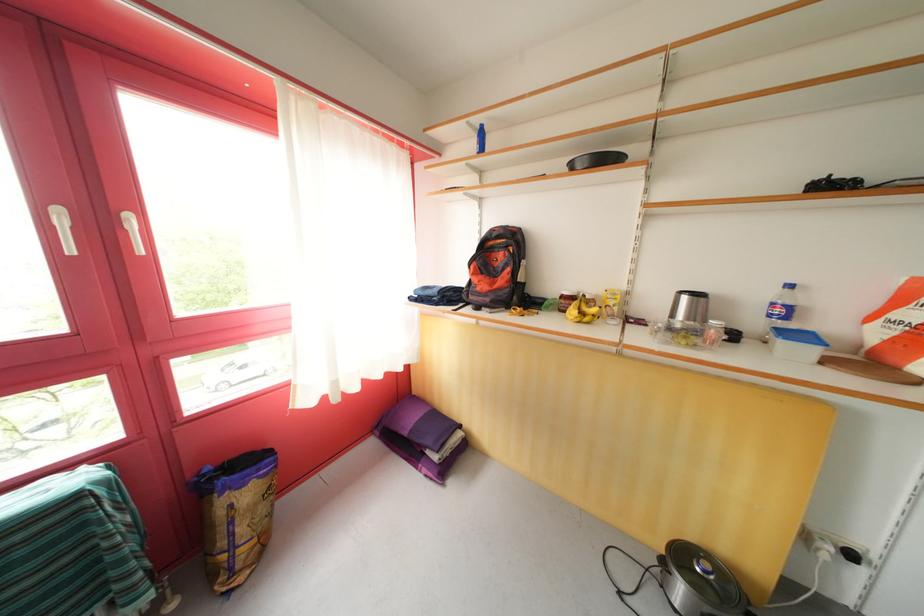
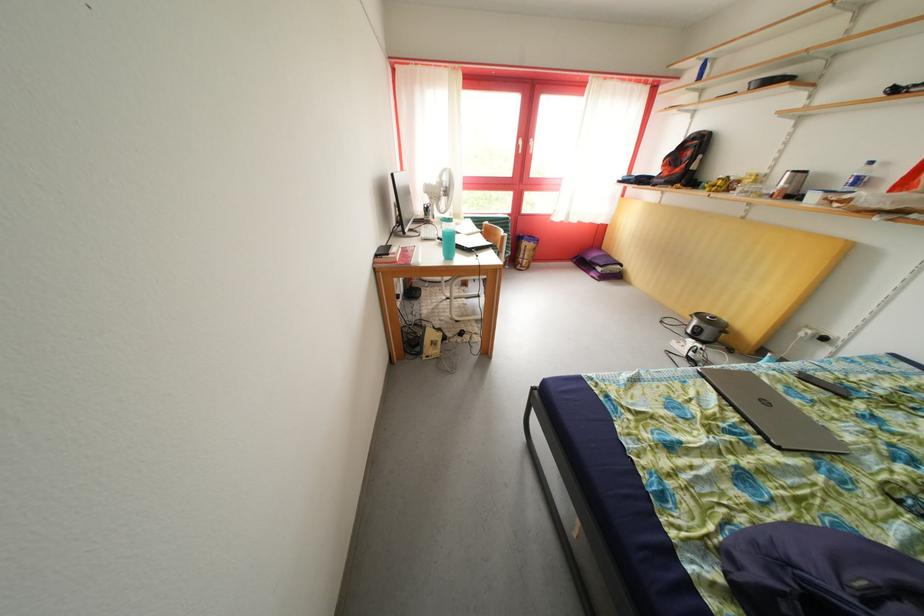
Locate, in the second image, the point that corresponds to (x=492, y=253) in the first image.

(689, 153)